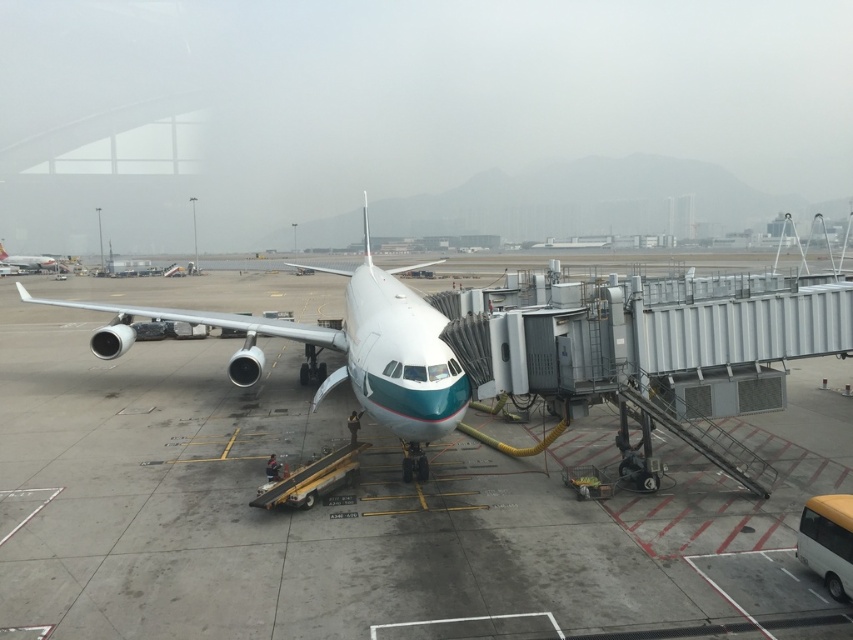
Question: Considering the real-world distances, which object is farthest from the white glossy airplane at center?

Choices:
 (A) gray concrete tarmac at center
 (B) white glossy airplane at upper left

Answer: (B)

Question: Which object is farther from the camera taking this photo?

Choices:
 (A) white glossy airplane at upper left
 (B) gray concrete tarmac at center

Answer: (A)

Question: Where is gray concrete tarmac at center located in relation to white glossy airplane at center in the image?

Choices:
 (A) right
 (B) left

Answer: (A)

Question: Does gray concrete tarmac at center appear under white glossy airplane at upper left?

Choices:
 (A) no
 (B) yes

Answer: (B)

Question: Which point is farther to the camera?

Choices:
 (A) gray concrete tarmac at center
 (B) white glossy airplane at upper left

Answer: (B)

Question: Where is gray concrete tarmac at center located in relation to white glossy airplane at upper left in the image?

Choices:
 (A) below
 (B) above

Answer: (A)